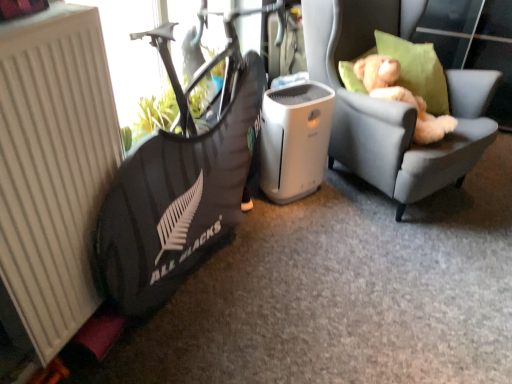
Question: Can you confirm if black fabric bean bag chair at left is smaller than white plastic air purifier at center?

Choices:
 (A) yes
 (B) no

Answer: (B)

Question: From the image's perspective, would you say black fabric bean bag chair at left is shown under white plastic air purifier at center?

Choices:
 (A) yes
 (B) no

Answer: (B)

Question: Can you confirm if black fabric bean bag chair at left is taller than white plastic air purifier at center?

Choices:
 (A) yes
 (B) no

Answer: (A)

Question: Is black fabric bean bag chair at left facing away from white plastic air purifier at center?

Choices:
 (A) no
 (B) yes

Answer: (B)

Question: From the image's perspective, is black fabric bean bag chair at left above white plastic air purifier at center?

Choices:
 (A) no
 (B) yes

Answer: (B)

Question: Is white plastic air purifier at center inside black fabric bean bag chair at left?

Choices:
 (A) no
 (B) yes

Answer: (A)

Question: From the image's perspective, is white plastic air purifier at center on top of black fabric bean bag chair at left?

Choices:
 (A) yes
 (B) no

Answer: (B)

Question: From a real-world perspective, is white plastic air purifier at center below black fabric bean bag chair at left?

Choices:
 (A) yes
 (B) no

Answer: (A)

Question: Is white plastic air purifier at center with black fabric bean bag chair at left?

Choices:
 (A) yes
 (B) no

Answer: (B)

Question: Is white plastic air purifier at center shorter than black fabric bean bag chair at left?

Choices:
 (A) no
 (B) yes

Answer: (B)

Question: Is white plastic air purifier at center positioned in front of black fabric bean bag chair at left?

Choices:
 (A) yes
 (B) no

Answer: (B)

Question: From a real-world perspective, does white plastic air purifier at center stand above black fabric bean bag chair at left?

Choices:
 (A) yes
 (B) no

Answer: (B)

Question: Is black fabric bean bag chair at left to the right of white matte radiator at left from the viewer's perspective?

Choices:
 (A) yes
 (B) no

Answer: (A)